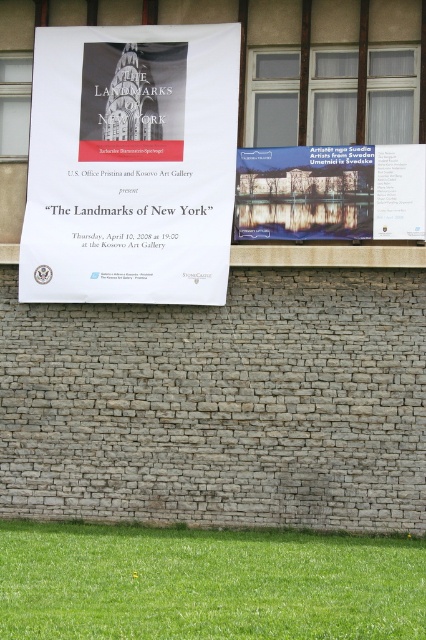
What is the spatial relationship between the white paper poster at upper center and the matte paper poster at center?

The white paper poster at upper center is positioned over the matte paper poster at center.